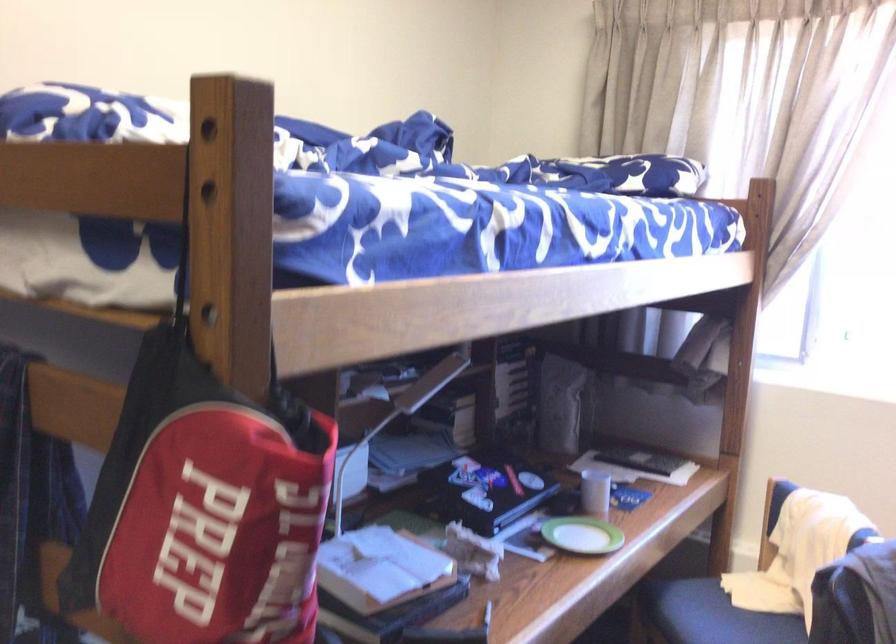
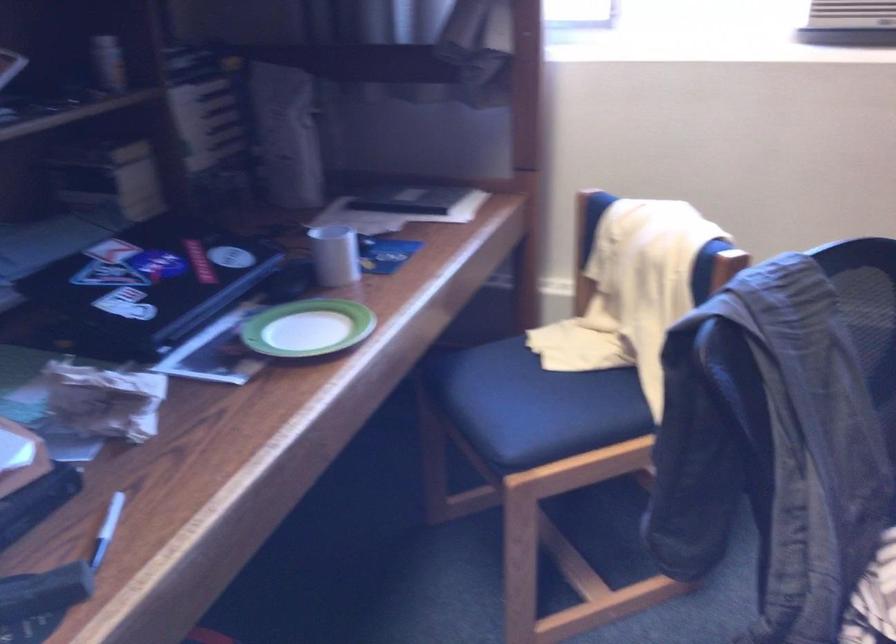
Question: The images are taken continuously from a first-person perspective. In which direction is your viewpoint rotating?

Choices:
 (A) Left
 (B) Right
 (C) Up
 (D) Down

Answer: (D)